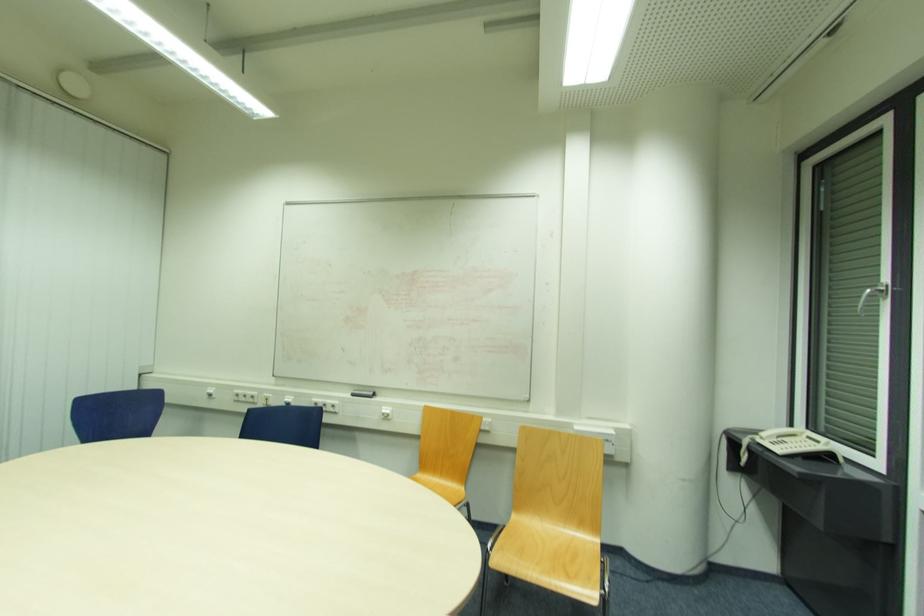
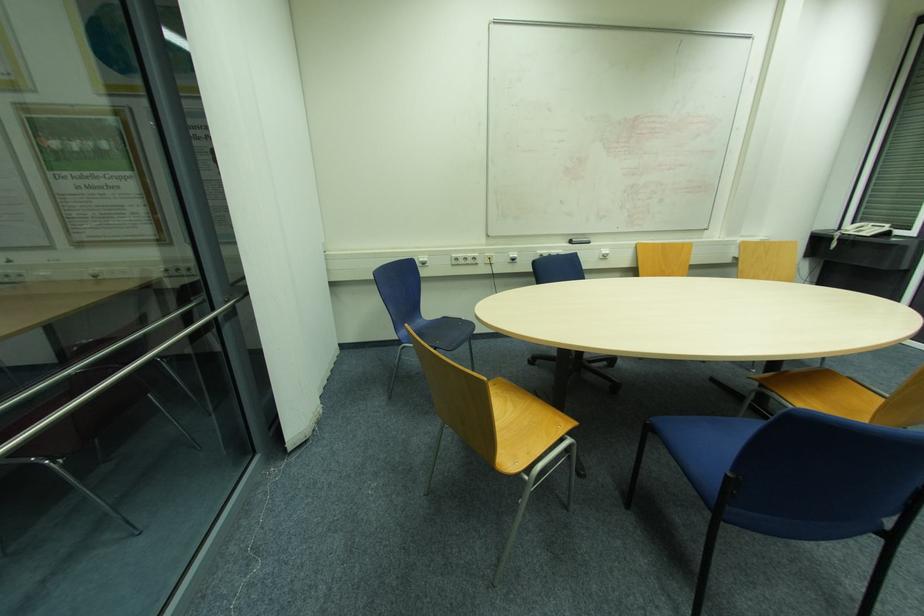
In the second image, find the point that corresponds to [385,411] in the first image.

(604, 253)